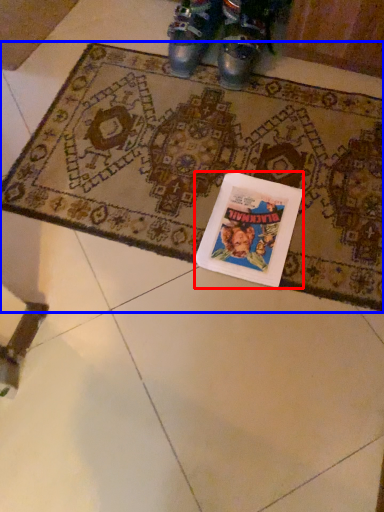
Question: Among these objects, which one is nearest to the camera, book cover (highlighted by a red box) or mat (highlighted by a blue box)?

Choices:
 (A) book cover
 (B) mat

Answer: (B)